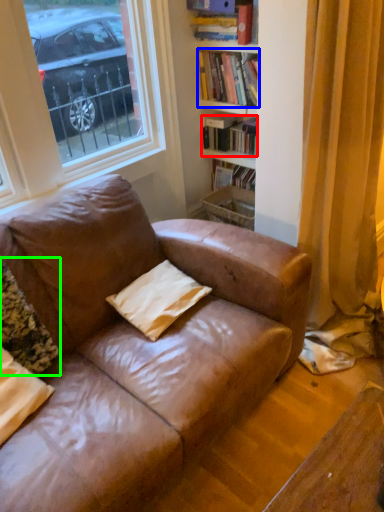
Question: Which is nearer to the book (highlighted by a red box)? book (highlighted by a blue box) or pillow (highlighted by a green box).

Choices:
 (A) book
 (B) pillow

Answer: (A)